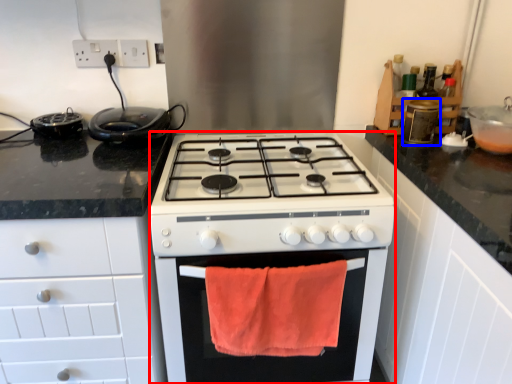
Question: Among these objects, which one is nearest to the camera, appliance (highlighted by a red box) or appliance (highlighted by a blue box)?

Choices:
 (A) appliance
 (B) appliance

Answer: (A)